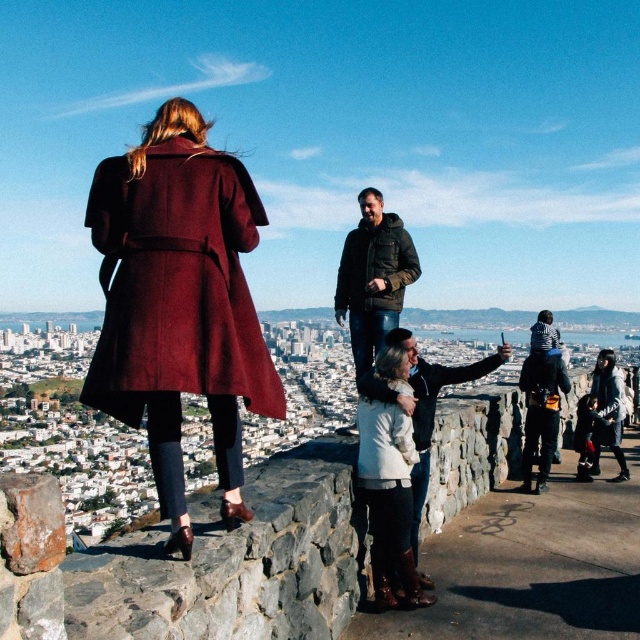
You are standing at the scenic overlook and want to locate the dark green jacket at center. According to the coordinates provided, where would you look to find it?

The dark green jacket at center is located at point coordinates (424,406).

In the scene shown: You are standing at the scenic overlook and want to take a photo of both the green textured jacket at center and the matte black jacket at lower right in the same frame. Given their distance apart, will you be able to fit both into your camera viewfinder without moving closer or farther away?

The green textured jacket at center is 788.71 feet from the matte black jacket at lower right. At that distance, it is unlikely you can fit both into the camera viewfinder without adjusting your position.

Consider the image. You are a photographer trying to capture a photo of the dark green jacket at center and the matte black jacket at lower right. Which jacket should you focus on first if you want to include both in your shot without moving the camera?

The dark green jacket at center is positioned under the matte black jacket at lower right, so you should focus on the matte black jacket at lower right first to ensure both are in the frame without moving the camera.